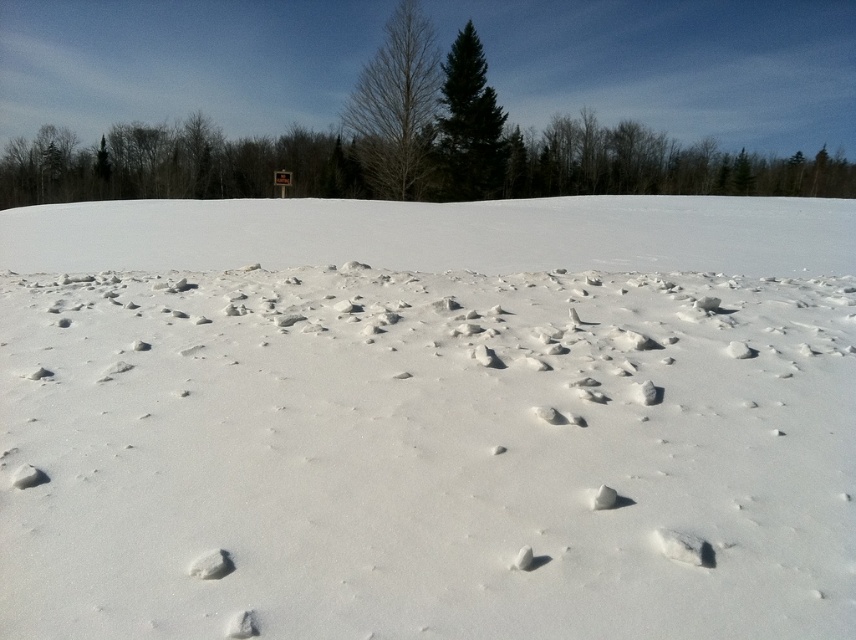
Question: Is white matte snow at center behind green glossy evergreen tree at center?

Choices:
 (A) yes
 (B) no

Answer: (B)

Question: Considering the relative positions of brown matte tree at center and green glossy evergreen tree at center in the image provided, where is brown matte tree at center located with respect to green glossy evergreen tree at center?

Choices:
 (A) above
 (B) below

Answer: (A)

Question: Which is nearer to the white matte snow at center?

Choices:
 (A) brown matte tree at center
 (B) green glossy evergreen tree at center

Answer: (A)

Question: Which of these objects is positioned farthest from the white matte snow at center?

Choices:
 (A) brown matte tree at center
 (B) green glossy evergreen tree at center

Answer: (B)

Question: Which of the following is the farthest from the observer?

Choices:
 (A) (458, 147)
 (B) (789, 518)
 (C) (377, 163)

Answer: (A)

Question: Can you confirm if white matte snow at center is thinner than green glossy evergreen tree at center?

Choices:
 (A) no
 (B) yes

Answer: (A)